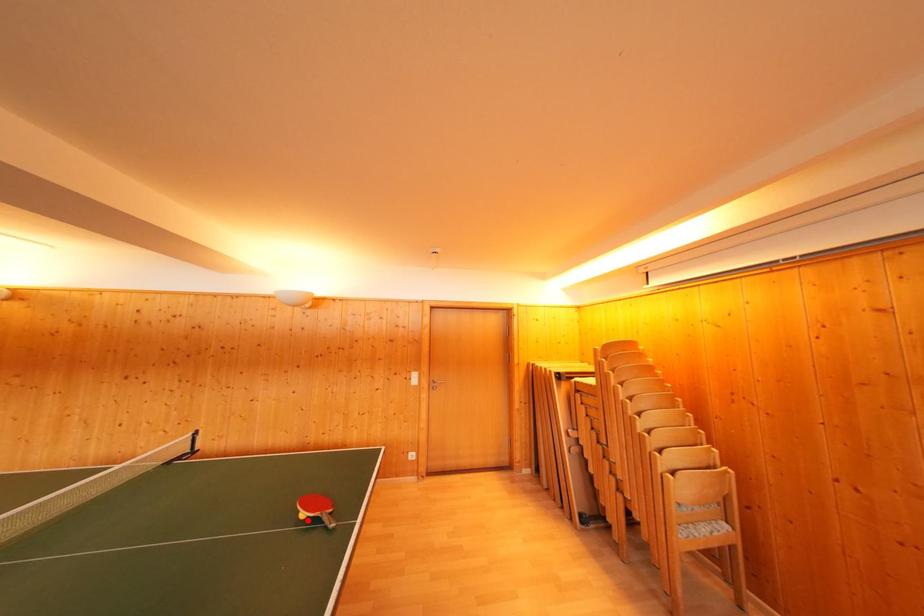
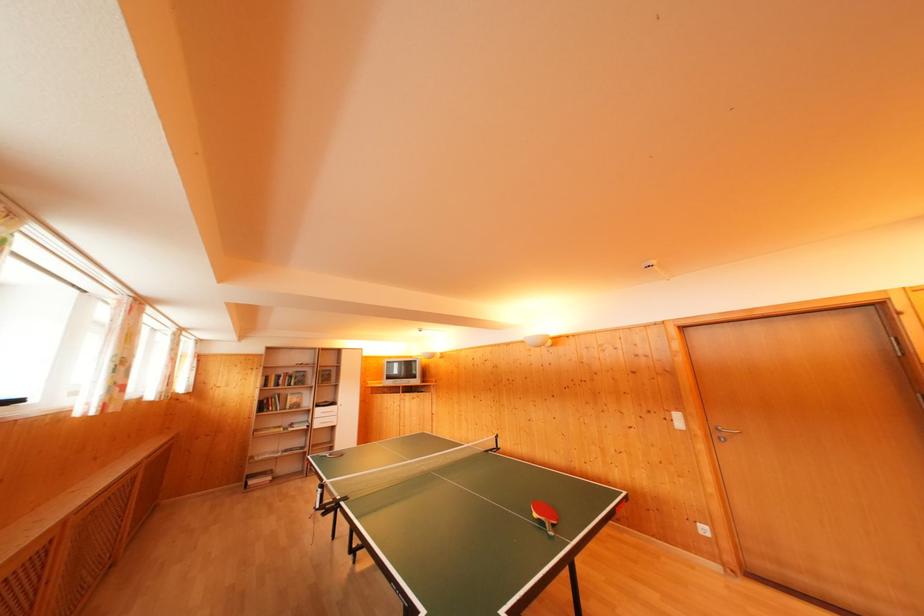
Locate, in the second image, the point that corresponds to the highlighted location in the first image.

(541, 521)